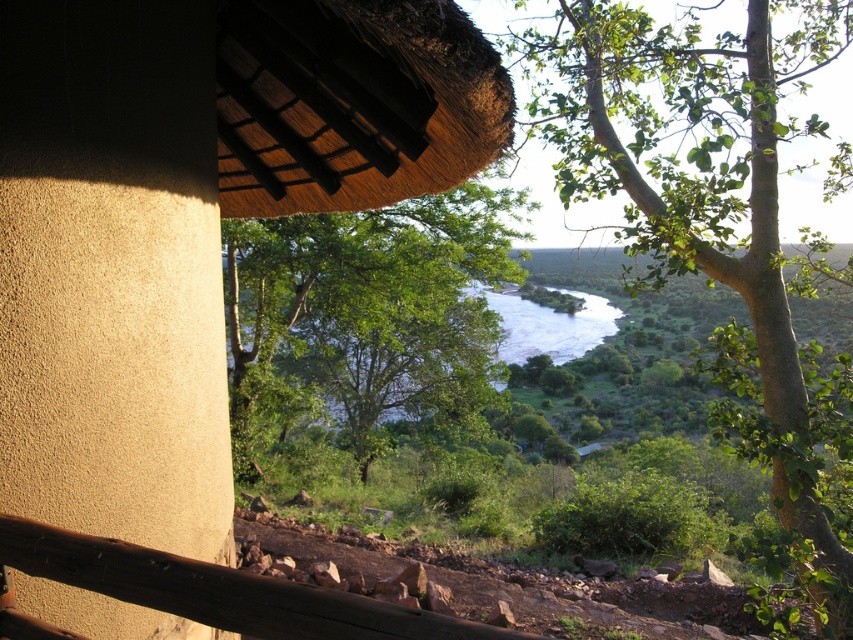
You are standing on the balcony and want to look at the green leafy tree at center without leaning over the brown wooden rail at lower center. Is the tree to your left or right side of the rail?

The green leafy tree at center is positioned on the left side of brown wooden rail at lower center, so it is to your left side of the rail.

You are standing on the balcony of the thatched roof hut at upper center. Looking out, you notice the river below. Based on the scene description, can you determine the direction the river flows relative to the hut?

The river flows away from the thatched roof hut at upper center, as it meanders through the valley below the structure.